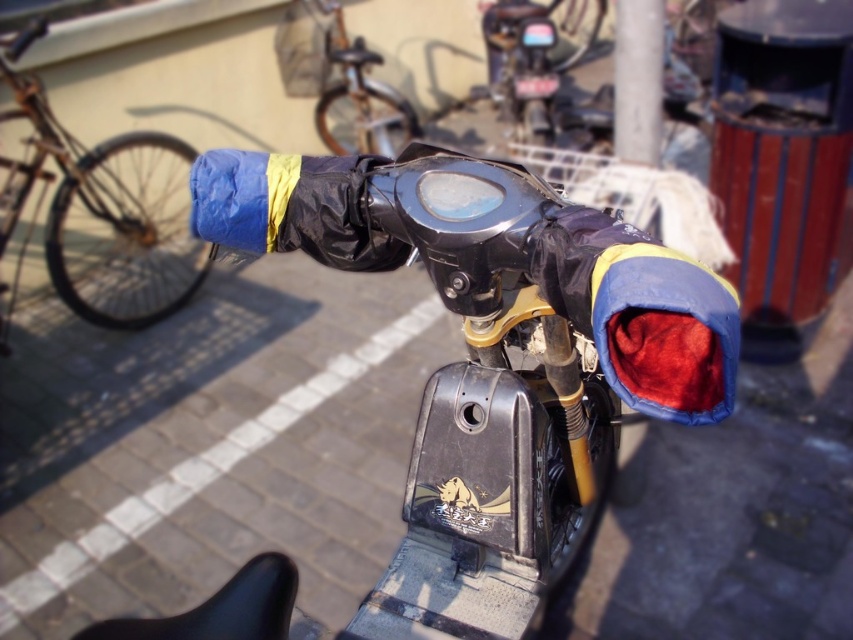
Question: Which point is farther to the camera?

Choices:
 (A) blue fabric handlebar cover at center
 (B) blue fabric handlebar cover at left

Answer: (B)

Question: Among these points, which one is farthest from the camera?

Choices:
 (A) (468, 536)
 (B) (151, 232)

Answer: (B)

Question: Where is blue fabric handlebar cover at center located in relation to blue fabric handlebar cover at left in the image?

Choices:
 (A) above
 (B) below

Answer: (B)

Question: Is blue fabric handlebar cover at center bigger than blue fabric handlebar cover at left?

Choices:
 (A) yes
 (B) no

Answer: (A)

Question: Does blue fabric handlebar cover at center appear on the left side of blue fabric handlebar cover at left?

Choices:
 (A) yes
 (B) no

Answer: (B)